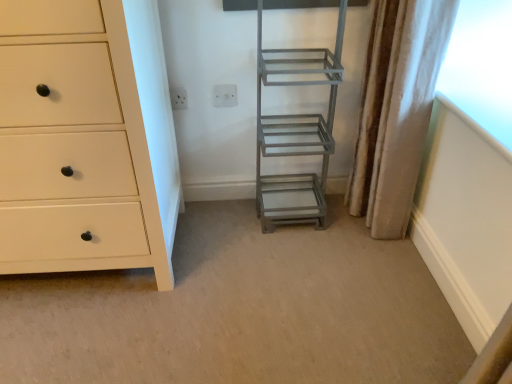
Image resolution: width=512 pixels, height=384 pixels. In order to click on vacant space in metallic gray ladder at center (from a real-world perspective) in this screenshot , I will do `click(298, 202)`.